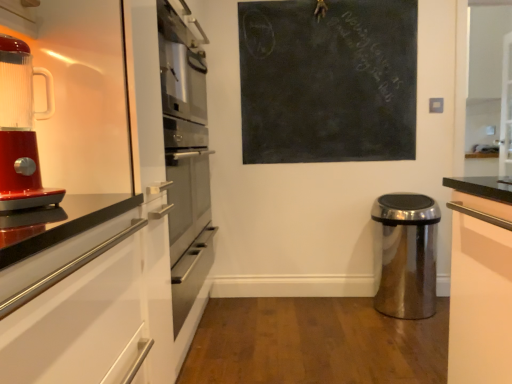
This screenshot has width=512, height=384. Find the location of `vacant area that is in front of polished stainless steel trash can at lower right`. vacant area that is in front of polished stainless steel trash can at lower right is located at coordinates (404, 334).